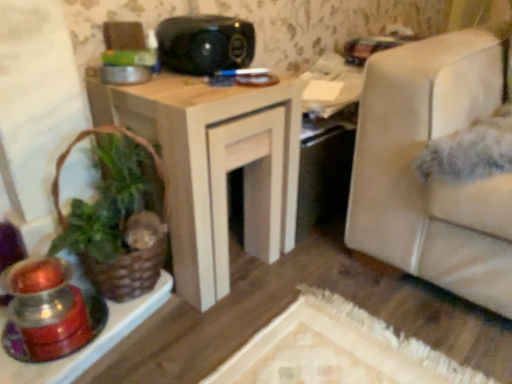
Question: Visually, is black plastic speaker at upper center positioned to the left or to the right of brown woven basket at left?

Choices:
 (A) left
 (B) right

Answer: (B)

Question: In terms of height, does black plastic speaker at upper center look taller or shorter compared to brown woven basket at left?

Choices:
 (A) short
 (B) tall

Answer: (A)

Question: Considering the real-world distances, which object is closest to the wooden table at center?

Choices:
 (A) black plastic speaker at upper center
 (B) brown woven basket at left
 (C) translucent glass candle holder at lower left

Answer: (B)

Question: Estimate the real-world distances between objects in this image. Which object is closer to the translucent glass candle holder at lower left?

Choices:
 (A) wooden table at center
 (B) black plastic speaker at upper center
 (C) brown woven basket at left

Answer: (C)